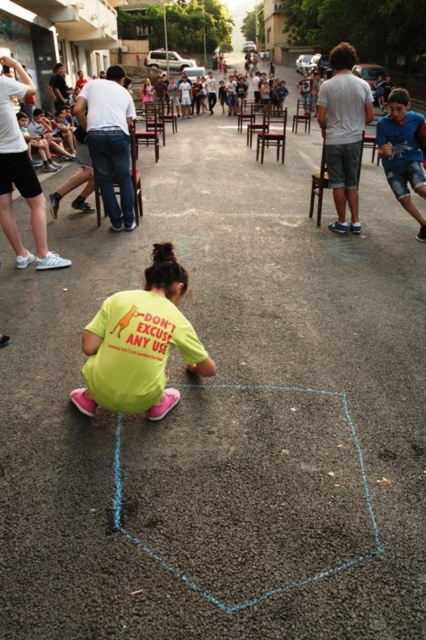
Does yellow matte shirt at lower center appear under blue denim shorts at right?

Yes.

Is point (147, 298) closer to viewer compared to point (394, 170)?

That is True.

Identify the location of yellow matte shirt at lower center. (140, 342).